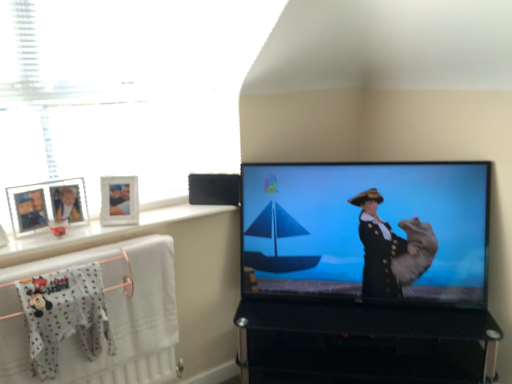
Question: Would you say black glass tv stand at lower right contains white textured towel at lower left?

Choices:
 (A) no
 (B) yes

Answer: (A)

Question: From the image's perspective, would you say black glass tv stand at lower right is positioned over white textured towel at lower left?

Choices:
 (A) no
 (B) yes

Answer: (A)

Question: Does black glass tv stand at lower right lie behind white textured towel at lower left?

Choices:
 (A) no
 (B) yes

Answer: (B)

Question: From the image's perspective, would you say black glass tv stand at lower right is shown under white textured towel at lower left?

Choices:
 (A) no
 (B) yes

Answer: (B)

Question: Is black glass tv stand at lower right in contact with white textured towel at lower left?

Choices:
 (A) yes
 (B) no

Answer: (B)

Question: In the image, is black plastic speaker at upper center positioned in front of or behind white textured towel at lower left?

Choices:
 (A) behind
 (B) front

Answer: (A)

Question: Which is correct: black plastic speaker at upper center is inside white textured towel at lower left, or outside of it?

Choices:
 (A) outside
 (B) inside

Answer: (A)

Question: Is black plastic speaker at upper center bigger or smaller than white textured towel at lower left?

Choices:
 (A) small
 (B) big

Answer: (A)

Question: In terms of height, does black plastic speaker at upper center look taller or shorter compared to white textured towel at lower left?

Choices:
 (A) short
 (B) tall

Answer: (A)

Question: Is black glass tv stand at lower right situated inside white fabric hanger at lower left or outside?

Choices:
 (A) outside
 (B) inside

Answer: (A)

Question: From the image's perspective, is black glass tv stand at lower right located above or below white fabric hanger at lower left?

Choices:
 (A) above
 (B) below

Answer: (B)

Question: Is point (313, 331) positioned closer to the camera than point (102, 263)?

Choices:
 (A) farther
 (B) closer

Answer: (A)

Question: Is black glass tv stand at lower right to the left or to the right of white fabric hanger at lower left in the image?

Choices:
 (A) left
 (B) right

Answer: (B)

Question: Do you think white glossy window sill at upper left is within white cotton onesie at lower left, or outside of it?

Choices:
 (A) inside
 (B) outside

Answer: (B)

Question: From a real-world perspective, is white glossy window sill at upper left above or below white cotton onesie at lower left?

Choices:
 (A) above
 (B) below

Answer: (A)